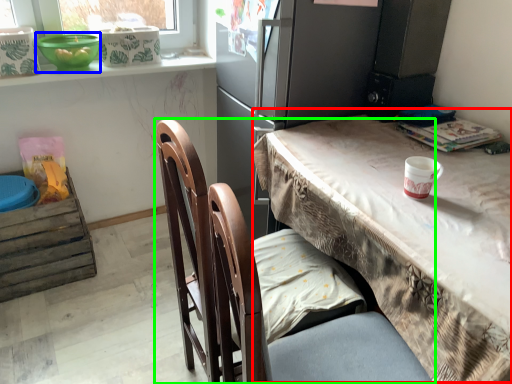
Question: Which is nearer to the table (highlighted by a red box)? bowl (highlighted by a blue box) or chair (highlighted by a green box).

Choices:
 (A) bowl
 (B) chair

Answer: (B)